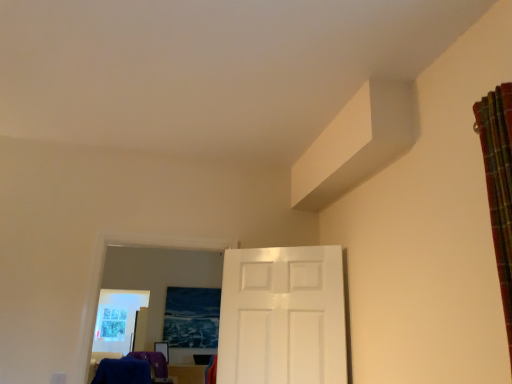
Question: Is blue fuzzy laundry at lower left bigger than white glossy door at center?

Choices:
 (A) yes
 (B) no

Answer: (B)

Question: From a real-world perspective, is blue fuzzy laundry at lower left located higher than white glossy door at center?

Choices:
 (A) yes
 (B) no

Answer: (B)

Question: Considering the relative sizes of blue fuzzy laundry at lower left and white glossy door at center in the image provided, is blue fuzzy laundry at lower left taller than white glossy door at center?

Choices:
 (A) yes
 (B) no

Answer: (B)

Question: Is blue fuzzy laundry at lower left smaller than white glossy door at center?

Choices:
 (A) no
 (B) yes

Answer: (B)

Question: Could you tell me if blue fuzzy laundry at lower left is turned towards white glossy door at center?

Choices:
 (A) no
 (B) yes

Answer: (A)

Question: Is blue fuzzy laundry at lower left at the right side of white glossy door at center?

Choices:
 (A) no
 (B) yes

Answer: (A)

Question: Would you say plaid fabric curtain at right is a long distance from white glossy door at center?

Choices:
 (A) yes
 (B) no

Answer: (A)

Question: Is plaid fabric curtain at right facing towards white glossy door at center?

Choices:
 (A) no
 (B) yes

Answer: (A)

Question: Is plaid fabric curtain at right to the right of white glossy door at center from the viewer's perspective?

Choices:
 (A) no
 (B) yes

Answer: (B)

Question: Is white glossy door at center located within plaid fabric curtain at right?

Choices:
 (A) no
 (B) yes

Answer: (A)

Question: Does plaid fabric curtain at right have a lesser width compared to white glossy door at center?

Choices:
 (A) yes
 (B) no

Answer: (B)

Question: From a real-world perspective, is plaid fabric curtain at right over white glossy door at center?

Choices:
 (A) no
 (B) yes

Answer: (B)

Question: Can you confirm if plaid fabric curtain at right is shorter than blue fuzzy laundry at lower left?

Choices:
 (A) yes
 (B) no

Answer: (B)